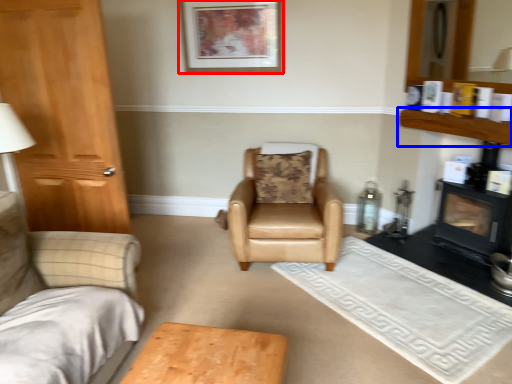
Question: Which object appears farthest to the camera in this image, picture frame (highlighted by a red box) or shelf (highlighted by a blue box)?

Choices:
 (A) picture frame
 (B) shelf

Answer: (A)